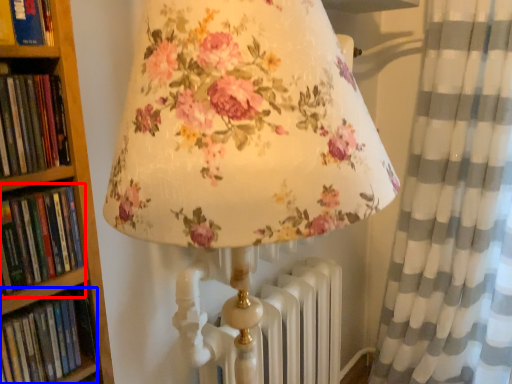
Question: Among these objects, which one is nearest to the camera, book (highlighted by a red box) or book (highlighted by a blue box)?

Choices:
 (A) book
 (B) book

Answer: (A)